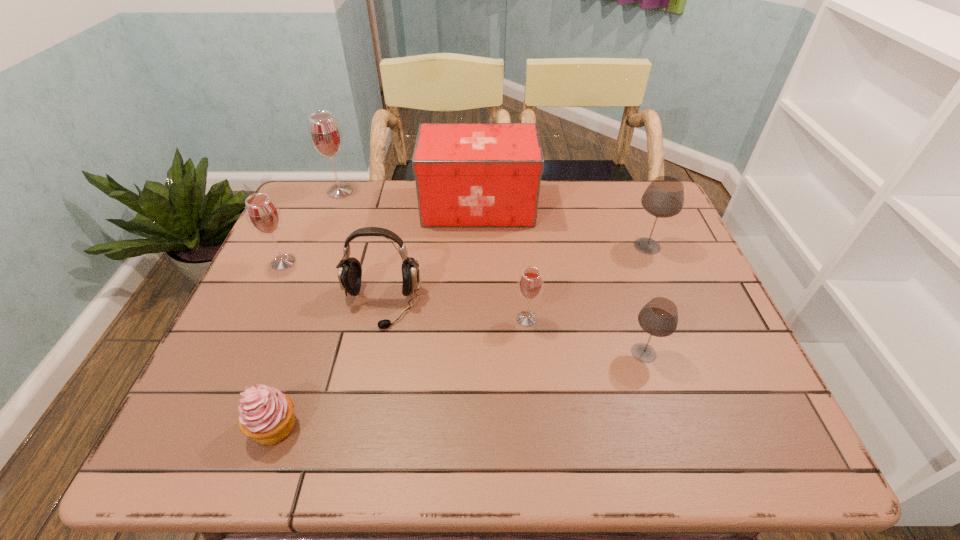
Image resolution: width=960 pixels, height=540 pixels. I want to click on the rightmost red wineglass, so click(x=530, y=284).

Find the location of `cupcake`. cupcake is located at coordinates (266, 415).

Where is `the nearest object`? the nearest object is located at coordinates (266, 415).

You are a GUI agent. You are given a task and a screenshot of the screen. Output one action in this format:
    pyautogui.click(x=<x>, y=<y>)
    Task: Click on the vacant region located 0.190m on the front of the farthest wineglass
    
    Given the screenshot: What is the action you would take?
    pyautogui.click(x=322, y=239)

Where is `free space located 0.130m on the handle side of the first-aid kit`? Image resolution: width=960 pixels, height=540 pixels. free space located 0.130m on the handle side of the first-aid kit is located at coordinates (578, 206).

At what (x,y) coordinates should I click in order to perform the action: click on free space located 0.320m on the right of the second biggest red wineglass. Please return your answer as a coordinate pair (x, y). The height and width of the screenshot is (540, 960). Looking at the image, I should click on (417, 262).

In order to click on free space located on the left of the rightmost object in this screenshot , I will do `click(571, 246)`.

The height and width of the screenshot is (540, 960). Find the location of `vacant space located 0.250m with the microphone on the side of the headset`. vacant space located 0.250m with the microphone on the side of the headset is located at coordinates (354, 435).

I want to click on vacant space located 0.170m on the left of the second object from right to left, so click(549, 353).

I want to click on vacant space situated 0.280m on the back of the nearest red wineglass, so click(x=518, y=235).